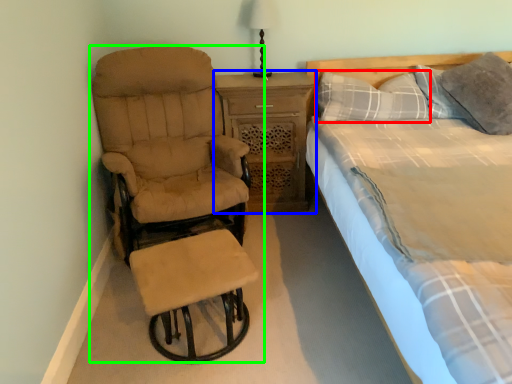
Question: Considering the real-world distances, which object is closest to pillow (highlighted by a red box)? nightstand (highlighted by a blue box) or chair (highlighted by a green box).

Choices:
 (A) nightstand
 (B) chair

Answer: (A)